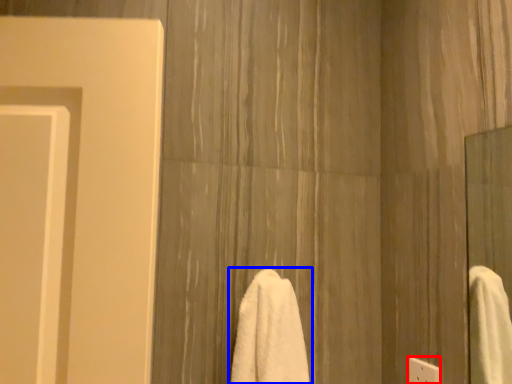
Question: Which point is further to the camera, electric outlet (highlighted by a red box) or towel (highlighted by a blue box)?

Choices:
 (A) electric outlet
 (B) towel

Answer: (A)